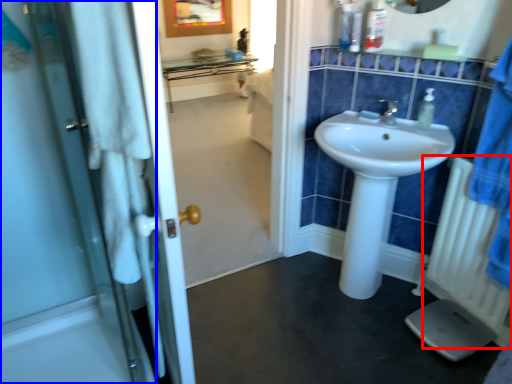
Question: Which object is closer to the camera taking this photo, radiator (highlighted by a red box) or door (highlighted by a blue box)?

Choices:
 (A) radiator
 (B) door

Answer: (B)